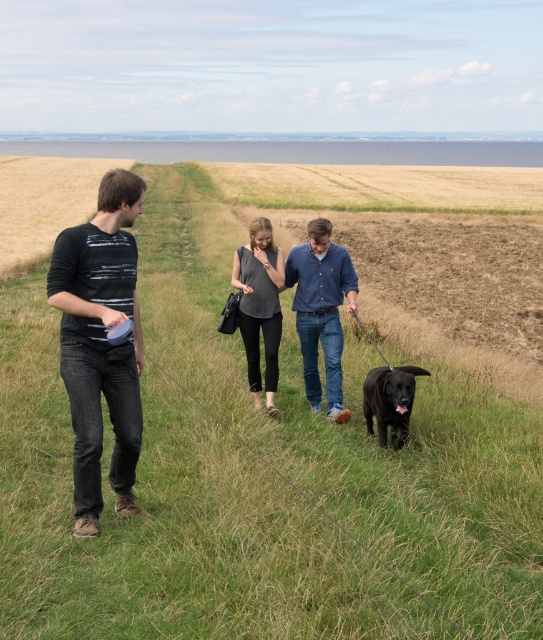
Question: Can you confirm if blue denim shirt at center is positioned to the left of black matte dog at lower center?

Choices:
 (A) no
 (B) yes

Answer: (B)

Question: Which object is positioned closest to the dark gray striped shirt at left?

Choices:
 (A) matte gray shirt at center
 (B) blue denim shirt at center

Answer: (A)

Question: Which object appears farthest from the camera in this image?

Choices:
 (A) black matte dog at lower center
 (B) dark gray striped shirt at left
 (C) matte gray shirt at center

Answer: (C)

Question: Which point is closer to the camera taking this photo?

Choices:
 (A) (390, 408)
 (B) (308, 344)
 (C) (269, 390)

Answer: (A)

Question: Is blue denim shirt at center bigger than black matte dog at lower center?

Choices:
 (A) no
 (B) yes

Answer: (B)

Question: Can you confirm if dark gray striped shirt at left is positioned to the left of blue denim shirt at center?

Choices:
 (A) no
 (B) yes

Answer: (B)